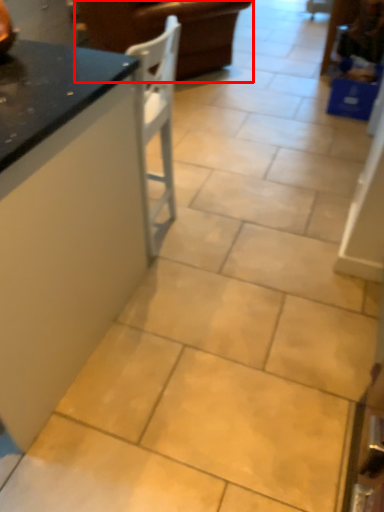
Question: Observing the image, what is the correct spatial positioning of furniture (annotated by the red box) in reference to countertop?

Choices:
 (A) left
 (B) right

Answer: (B)